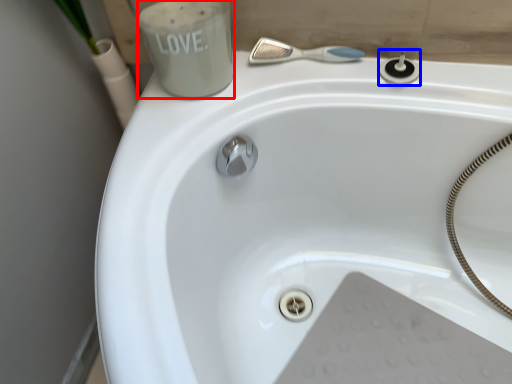
Question: Which object is further to the camera taking this photo, liquid (highlighted by a red box) or plumbing fixture (highlighted by a blue box)?

Choices:
 (A) liquid
 (B) plumbing fixture

Answer: (B)